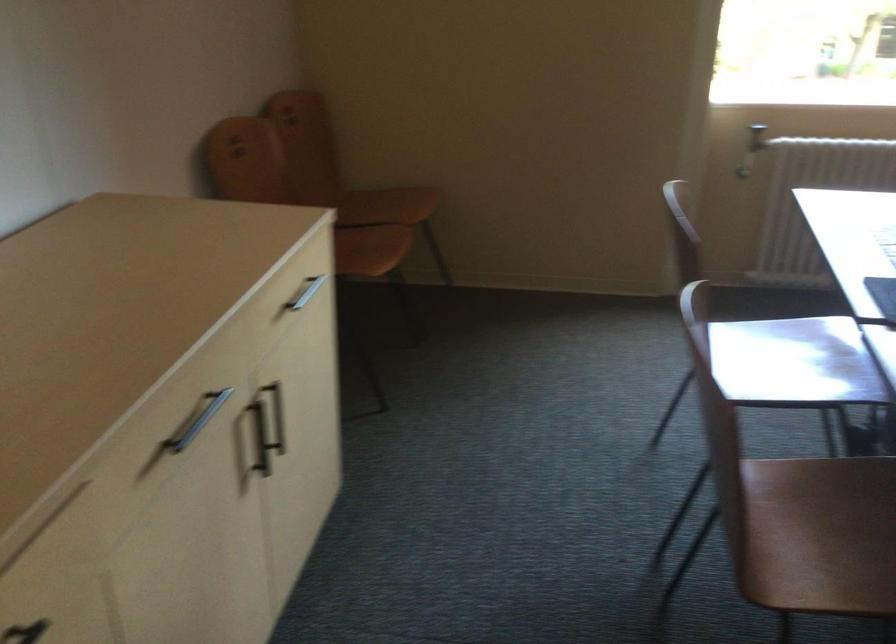
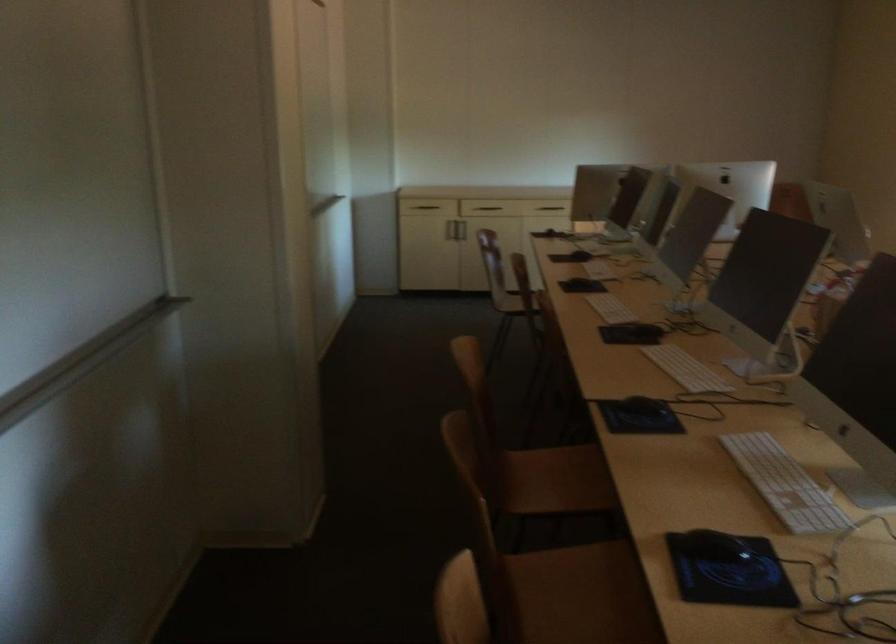
Question: I am providing you with two images of the same scene from different viewpoints. Please identify which objects are invisible in image2.

Choices:
 (A) wooden chair sitting surface
 (B) drawer pull cutout
 (C) white computer keyboard
 (D) silver cabinet handle

Answer: (D)